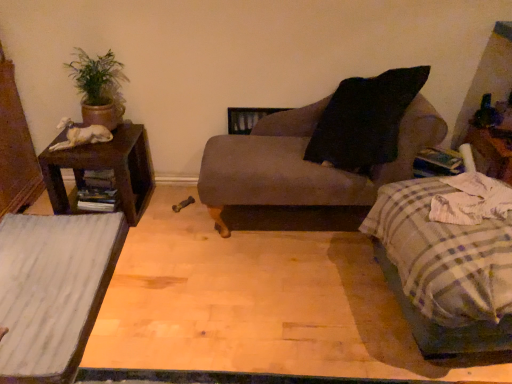
Question: Would you say brown wood nightstand at left is outside plaid fabric bed at lower right?

Choices:
 (A) yes
 (B) no

Answer: (A)

Question: Is brown wood nightstand at left bigger than plaid fabric bed at lower right?

Choices:
 (A) yes
 (B) no

Answer: (B)

Question: From the image's perspective, is brown wood nightstand at left below plaid fabric bed at lower right?

Choices:
 (A) no
 (B) yes

Answer: (A)

Question: Is brown wood nightstand at left smaller than plaid fabric bed at lower right?

Choices:
 (A) no
 (B) yes

Answer: (B)

Question: Could plaid fabric bed at lower right be considered to be inside brown wood nightstand at left?

Choices:
 (A) yes
 (B) no

Answer: (B)

Question: Is brown wood nightstand at left at the left side of plaid fabric bed at lower right?

Choices:
 (A) no
 (B) yes

Answer: (B)

Question: Considering the relative sizes of white wood table at lower left and green matte plant at upper left in the image provided, is white wood table at lower left thinner than green matte plant at upper left?

Choices:
 (A) no
 (B) yes

Answer: (A)

Question: Is white wood table at lower left not within green matte plant at upper left?

Choices:
 (A) no
 (B) yes

Answer: (B)

Question: From the image's perspective, is white wood table at lower left over green matte plant at upper left?

Choices:
 (A) yes
 (B) no

Answer: (B)

Question: Is white wood table at lower left wider than green matte plant at upper left?

Choices:
 (A) no
 (B) yes

Answer: (B)

Question: Is green matte plant at upper left at the back of white wood table at lower left?

Choices:
 (A) no
 (B) yes

Answer: (A)

Question: Considering the relative positions of white wood table at lower left and green matte plant at upper left in the image provided, is white wood table at lower left behind green matte plant at upper left?

Choices:
 (A) yes
 (B) no

Answer: (B)

Question: From a real-world perspective, does matte gray chaise at center sit lower than brown wood nightstand at left?

Choices:
 (A) no
 (B) yes

Answer: (A)